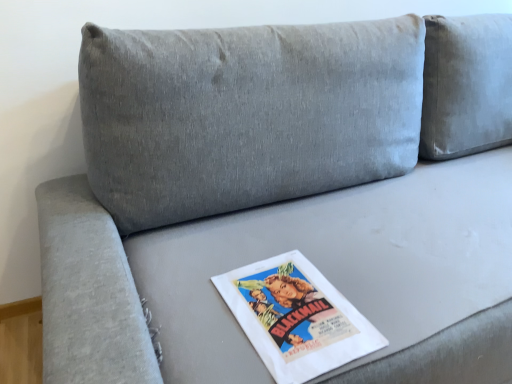
What do you see at coordinates (296, 317) in the screenshot? The image size is (512, 384). I see `vintage paper at center` at bounding box center [296, 317].

The width and height of the screenshot is (512, 384). Find the location of `vintage paper at center`. vintage paper at center is located at coordinates (296, 317).

Measure the distance between vintage paper at center and camera.

vintage paper at center is 65.43 centimeters from camera.

Image resolution: width=512 pixels, height=384 pixels. I want to click on vintage paper at center, so click(x=296, y=317).